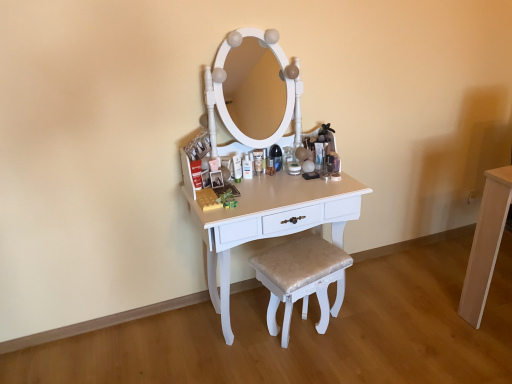
Question: Is shiny beige cushioned stool at center bigger than white glossy table at center, which appears as the 1th table when viewed from the left?

Choices:
 (A) yes
 (B) no

Answer: (B)

Question: Are shiny beige cushioned stool at center and white glossy table at center, which appears as the 1th table when viewed from the left, making contact?

Choices:
 (A) no
 (B) yes

Answer: (A)

Question: Is shiny beige cushioned stool at center positioned beyond the bounds of white glossy table at center, which appears as the 1th table when viewed from the left?

Choices:
 (A) yes
 (B) no

Answer: (B)

Question: From the image's perspective, is shiny beige cushioned stool at center located above white glossy table at center, the 2th table in the right-to-left sequence?

Choices:
 (A) yes
 (B) no

Answer: (B)

Question: Is the position of shiny beige cushioned stool at center more distant than that of white glossy table at center, which appears as the 1th table when viewed from the left?

Choices:
 (A) no
 (B) yes

Answer: (B)

Question: From a real-world perspective, is shiny beige cushioned stool at center physically below white glossy table at center, which appears as the 1th table when viewed from the left?

Choices:
 (A) yes
 (B) no

Answer: (A)

Question: Is light wood cabinet at right, the 2th table when ordered from left to right, not within matte white lotion at center?

Choices:
 (A) no
 (B) yes

Answer: (B)

Question: Is light wood cabinet at right, the 2th table when ordered from left to right, surrounding matte white lotion at center?

Choices:
 (A) no
 (B) yes

Answer: (A)

Question: Does light wood cabinet at right, the 2th table when ordered from left to right, turn towards matte white lotion at center?

Choices:
 (A) yes
 (B) no

Answer: (B)

Question: Can you confirm if light wood cabinet at right, the 1th table when ordered from right to left, is smaller than matte white lotion at center?

Choices:
 (A) no
 (B) yes

Answer: (A)

Question: Does light wood cabinet at right, the 2th table when ordered from left to right, have a greater width compared to matte white lotion at center?

Choices:
 (A) no
 (B) yes

Answer: (B)

Question: Is light wood cabinet at right, the 2th table when ordered from left to right, further to camera compared to matte white lotion at center?

Choices:
 (A) no
 (B) yes

Answer: (A)

Question: Is white glossy table at center, the 2th table in the right-to-left sequence, surrounding shiny beige cushioned stool at center?

Choices:
 (A) no
 (B) yes

Answer: (B)